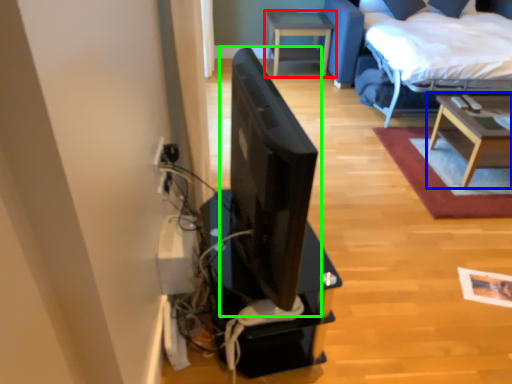
Question: Which is nearer to the table (highlighted by a red box)? table (highlighted by a blue box) or computer monitor (highlighted by a green box).

Choices:
 (A) table
 (B) computer monitor

Answer: (A)